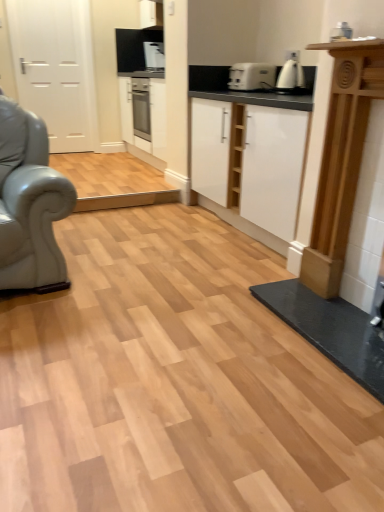
Locate an element on the screen. white glossy kettle at upper right, the second coffee machine when ordered from back to front is located at coordinates (290, 74).

What do you see at coordinates (251, 76) in the screenshot? The width and height of the screenshot is (384, 512). I see `white plastic toaster at center` at bounding box center [251, 76].

Where is `satin silver coffee machine at upper center, positioned as the 2th coffee machine in front-to-back order`? This screenshot has height=512, width=384. satin silver coffee machine at upper center, positioned as the 2th coffee machine in front-to-back order is located at coordinates (154, 56).

From the image's perspective, between white matte door at left and white glossy kettle at upper right, the second coffee machine when ordered from back to front, who is located below?

From the image's view, white glossy kettle at upper right, the second coffee machine when ordered from back to front, is below.

Is white matte door at left situated inside white glossy kettle at upper right, the second coffee machine when ordered from back to front, or outside?

The correct answer is: outside.

Consider the image. Is white matte door at left closer to camera compared to white glossy kettle at upper right, the second coffee machine when ordered from back to front?

No, it is not.

Does white matte door at left have a greater width compared to white glossy kettle at upper right, which is counted as the 2th coffee machine, starting from the left?

In fact, white matte door at left might be narrower than white glossy kettle at upper right, which is counted as the 2th coffee machine, starting from the left.

Does white matte cabinet at center have a larger size compared to satin silver coffee machine at upper center, marked as the 2th coffee machine in a right-to-left arrangement?

Yes, white matte cabinet at center is bigger than satin silver coffee machine at upper center, marked as the 2th coffee machine in a right-to-left arrangement.

From the image's perspective, between white matte cabinet at center and satin silver coffee machine at upper center, arranged as the 1th coffee machine when viewed from the top, who is located below?

white matte cabinet at center.

How different are the orientations of white matte cabinet at center and satin silver coffee machine at upper center, the 1th coffee machine from the back, in degrees?

They differ by 92 degrees in their facing directions.

Is point (300, 161) farther from camera compared to point (150, 68)?

No, it is not.

From a real-world perspective, who is located higher, white matte door at left or white plastic toaster at center?

In real-world perspective, white plastic toaster at center is above.

In the scene shown: From the image's perspective, is white matte door at left under white plastic toaster at center?

No, from the image's perspective, white matte door at left is not below white plastic toaster at center.

The height and width of the screenshot is (512, 384). What are the coordinates of `appliance in front of the white matte door at left` in the screenshot? It's located at (251, 76).

What's the angular difference between white matte door at left and white plastic toaster at center's facing directions?

white matte door at left and white plastic toaster at center are facing 88.7 degrees away from each other.

Considering the positions of objects white plastic toaster at center and white matte door at left in the image provided, who is more to the right, white plastic toaster at center or white matte door at left?

white plastic toaster at center is more to the right.

How much distance is there between white plastic toaster at center and white matte door at left?

white plastic toaster at center is 2.83 meters from white matte door at left.

The height and width of the screenshot is (512, 384). I want to click on door on the left side of white plastic toaster at center, so click(56, 69).

From a real-world perspective, who is located lower, white plastic toaster at center or white matte door at left?

From a 3D spatial view, white matte door at left is below.

From a real-world perspective, is satin silver coffee machine at upper center, the 1th coffee machine viewed from the left, located higher than white matte cabinet at center?

Correct, in the physical world, satin silver coffee machine at upper center, the 1th coffee machine viewed from the left, is higher than white matte cabinet at center.

From the image's perspective, which one is positioned lower, satin silver coffee machine at upper center, the 1th coffee machine viewed from the left, or white matte cabinet at center?

white matte cabinet at center is shown below in the image.

Looking at their sizes, would you say satin silver coffee machine at upper center, positioned as the 2th coffee machine in front-to-back order, is wider or thinner than white matte cabinet at center?

Considering their sizes, satin silver coffee machine at upper center, positioned as the 2th coffee machine in front-to-back order, looks slimmer than white matte cabinet at center.

Based on the photo, can you confirm if satin silver coffee machine at upper center, the 1th coffee machine viewed from the left, is shorter than white matte cabinet at center?

Yes.

Looking at their sizes, would you say white matte cabinet at center is wider or thinner than white plastic toaster at center?

Clearly, white matte cabinet at center has more width compared to white plastic toaster at center.

Considering the positions of point (240, 208) and point (248, 79), is point (240, 208) closer or farther from the camera than point (248, 79)?

Point (240, 208) appears to be closer to the viewer than point (248, 79).

Between white matte cabinet at center and white plastic toaster at center, which one is positioned in front?

white matte cabinet at center is more forward.

Is white matte cabinet at center inside the boundaries of white plastic toaster at center, or outside?

white matte cabinet at center is outside white plastic toaster at center.

From a real-world perspective, is white plastic toaster at center beneath satin silver coffee machine at upper center, the 1th coffee machine viewed from the left?

Yes, from a real-world perspective, white plastic toaster at center is under satin silver coffee machine at upper center, the 1th coffee machine viewed from the left.

Between white plastic toaster at center and satin silver coffee machine at upper center, arranged as the 1th coffee machine when viewed from the top, which one has less height?

white plastic toaster at center is shorter.

Looking at the image, does white plastic toaster at center seem bigger or smaller compared to satin silver coffee machine at upper center, the second coffee machine when ordered from bottom to top?

white plastic toaster at center is bigger than satin silver coffee machine at upper center, the second coffee machine when ordered from bottom to top.

You are a GUI agent. You are given a task and a screenshot of the screen. Output one action in this format:
    pyautogui.click(x=<x>, y=<y>)
    Task: Click on the door above the white glossy kettle at upper right, the second coffee machine when ordered from back to front (from the image's perspective)
    
    Given the screenshot: What is the action you would take?
    click(56, 69)

You are a GUI agent. You are given a task and a screenshot of the screen. Output one action in this format:
    pyautogui.click(x=<x>, y=<y>)
    Task: Click on the cabinetry below the satin silver coffee machine at upper center, the second coffee machine when ordered from bottom to top (from the image's perspective)
    
    Given the screenshot: What is the action you would take?
    pyautogui.click(x=250, y=160)

Which object lies further to the anchor point white matte cabinet at center, white matte door at left or white glossy kettle at upper right, the first coffee machine from the bottom?

white matte door at left is further to white matte cabinet at center.

Estimate the real-world distances between objects in this image. Which object is further from satin silver coffee machine at upper center, marked as the 2th coffee machine in a right-to-left arrangement, white matte cabinet at center or white plastic toaster at center?

Based on the image, white matte cabinet at center appears to be further to satin silver coffee machine at upper center, marked as the 2th coffee machine in a right-to-left arrangement.

When comparing their distances from white glossy kettle at upper right, the second coffee machine when ordered from back to front, does white matte cabinet at center or white matte door at left seem further?

white matte door at left is positioned further to the anchor white glossy kettle at upper right, the second coffee machine when ordered from back to front.

Considering their positions, is white matte door at left positioned closer to white matte cabinet at center than white plastic toaster at center?

white plastic toaster at center lies closer to white matte cabinet at center than the other object.

Looking at the image, which one is located further to white glossy kettle at upper right, the first coffee machine from the bottom, white matte door at left or white plastic toaster at center?

Among the two, white matte door at left is located further to white glossy kettle at upper right, the first coffee machine from the bottom.

Based on their spatial positions, is white glossy kettle at upper right, the second coffee machine when ordered from back to front, or satin silver coffee machine at upper center, marked as the 2th coffee machine in a right-to-left arrangement, further from white matte door at left?

white glossy kettle at upper right, the second coffee machine when ordered from back to front.

When comparing their distances from satin silver coffee machine at upper center, positioned as the 2th coffee machine in front-to-back order, does white glossy kettle at upper right, acting as the 1th coffee machine starting from the front, or white matte door at left seem further?

The object further to satin silver coffee machine at upper center, positioned as the 2th coffee machine in front-to-back order, is white glossy kettle at upper right, acting as the 1th coffee machine starting from the front.

When comparing their distances from white matte cabinet at center, does white plastic toaster at center or white matte door at left seem further?

white matte door at left is further to white matte cabinet at center.

At what (x,y) coordinates should I click in order to perform the action: click on coffee machine between white matte cabinet at center and white plastic toaster at center along the z-axis. Please return your answer as a coordinate pair (x, y). Looking at the image, I should click on (290, 74).

The height and width of the screenshot is (512, 384). In order to click on door located between white matte cabinet at center and satin silver coffee machine at upper center, arranged as the 1th coffee machine when viewed from the top, in the depth direction in this screenshot , I will do `click(56, 69)`.

The height and width of the screenshot is (512, 384). I want to click on appliance between white matte door at left and white glossy kettle at upper right, the first coffee machine from the bottom, from left to right, so click(251, 76).

I want to click on appliance between white matte door at left and white matte cabinet at center in the horizontal direction, so click(x=251, y=76).